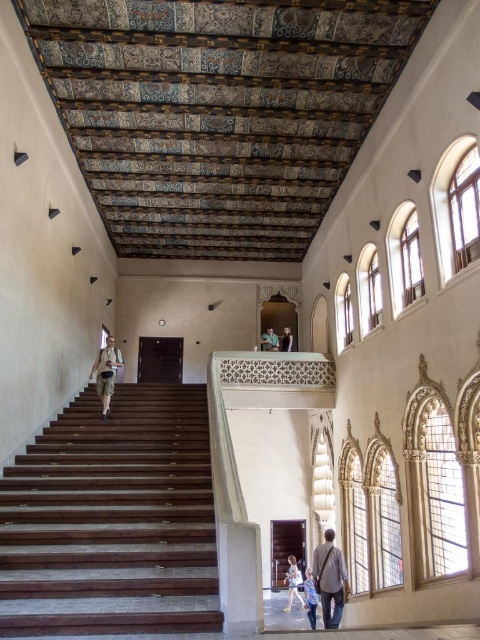
Identify the location of dark wood stairs at left. (111, 518).

Can you confirm if dark wood stairs at left is positioned to the right of light blue denim jeans at lower center?

No, dark wood stairs at left is not to the right of light blue denim jeans at lower center.

The height and width of the screenshot is (640, 480). I want to click on dark wood stairs at left, so click(111, 518).

Is dark wood stairs at left bigger than denim jacket at lower right?

Correct, dark wood stairs at left is larger in size than denim jacket at lower right.

Is dark wood stairs at left taller than denim jacket at lower right?

Correct, dark wood stairs at left is much taller as denim jacket at lower right.

You are a GUI agent. You are given a task and a screenshot of the screen. Output one action in this format:
    pyautogui.click(x=<x>, y=<y>)
    Task: Click on the dark wood stairs at left
    
    Given the screenshot: What is the action you would take?
    pyautogui.click(x=111, y=518)

Who is positioned more to the left, light blue denim jeans at lower center or light brown leather jacket at upper center?

From the viewer's perspective, light blue denim jeans at lower center appears more on the left side.

Can you confirm if light blue denim jeans at lower center is wider than light brown leather jacket at upper center?

Correct, the width of light blue denim jeans at lower center exceeds that of light brown leather jacket at upper center.

Is point (288, 589) closer to camera compared to point (290, 346)?

Yes, point (288, 589) is closer to viewer.

You are a GUI agent. You are given a task and a screenshot of the screen. Output one action in this format:
    pyautogui.click(x=<x>, y=<y>)
    Task: Click on the light blue denim jeans at lower center
    This screenshot has height=640, width=480.
    Given the screenshot: What is the action you would take?
    (x=292, y=582)